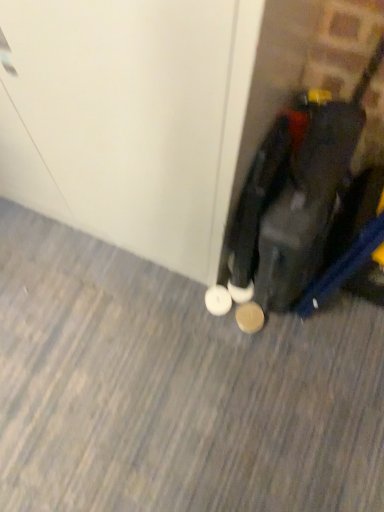
Question: Can you confirm if brown suede shoe at lower right is thinner than matte black suitcase at lower right?

Choices:
 (A) yes
 (B) no

Answer: (A)

Question: Is brown suede shoe at lower right with matte black suitcase at lower right?

Choices:
 (A) yes
 (B) no

Answer: (B)

Question: Does brown suede shoe at lower right have a greater height compared to matte black suitcase at lower right?

Choices:
 (A) yes
 (B) no

Answer: (B)

Question: From the image's perspective, would you say brown suede shoe at lower right is positioned over matte black suitcase at lower right?

Choices:
 (A) no
 (B) yes

Answer: (A)

Question: Is brown suede shoe at lower right positioned with its back to matte black suitcase at lower right?

Choices:
 (A) yes
 (B) no

Answer: (A)

Question: Does point (261, 321) appear closer or farther from the camera than point (31, 204)?

Choices:
 (A) closer
 (B) farther

Answer: (A)

Question: From the image's perspective, is brown suede shoe at lower right positioned above or below white glossy door at center?

Choices:
 (A) below
 (B) above

Answer: (A)

Question: From a real-world perspective, is brown suede shoe at lower right physically located above or below white glossy door at center?

Choices:
 (A) above
 (B) below

Answer: (B)

Question: In terms of width, does brown suede shoe at lower right look wider or thinner when compared to white glossy door at center?

Choices:
 (A) wide
 (B) thin

Answer: (B)

Question: From the image's perspective, is matte black suitcase at lower right located above or below brown suede shoe at lower right?

Choices:
 (A) below
 (B) above

Answer: (B)

Question: Is matte black suitcase at lower right taller or shorter than brown suede shoe at lower right?

Choices:
 (A) tall
 (B) short

Answer: (A)

Question: In the image, is matte black suitcase at lower right positioned in front of or behind brown suede shoe at lower right?

Choices:
 (A) behind
 (B) front

Answer: (B)

Question: Is matte black suitcase at lower right situated inside brown suede shoe at lower right or outside?

Choices:
 (A) inside
 (B) outside

Answer: (B)

Question: Does point (283, 183) appear closer or farther from the camera than point (61, 121)?

Choices:
 (A) closer
 (B) farther

Answer: (B)

Question: In terms of size, does matte black suitcase at lower right appear bigger or smaller than white glossy door at center?

Choices:
 (A) small
 (B) big

Answer: (A)